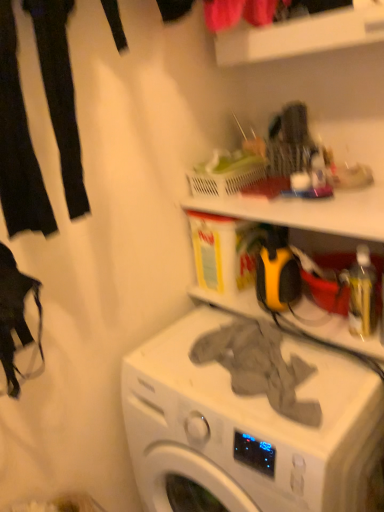
You are a GUI agent. You are given a task and a screenshot of the screen. Output one action in this format:
    pyautogui.click(x=<x>, y=<y>)
    Task: Click on the translucent plastic basket at upper center
    This screenshot has height=512, width=384.
    Given the screenshot: What is the action you would take?
    pyautogui.click(x=224, y=179)

In order to face black fabric pants at left, which is the 1th clothing in left-to-right order, should I rotate leftwards or rightwards?

You should rotate left by 20.965 degrees.

Describe the element at coordinates (259, 366) in the screenshot. I see `gray fabric at center, acting as the 1th clothing starting from the right` at that location.

I want to click on translucent plastic basket at upper center, so click(224, 179).

Could you measure the distance between gray fabric at center, which is counted as the second clothing, starting from the left, and black fabric pants at left, which is counted as the 1th clothing, starting from the top?

gray fabric at center, which is counted as the second clothing, starting from the left, and black fabric pants at left, which is counted as the 1th clothing, starting from the top, are 60.79 centimeters apart.

Considering the relative sizes of gray fabric at center, placed as the first clothing when sorted from bottom to top, and black fabric pants at left, which is counted as the 1th clothing, starting from the top, in the image provided, is gray fabric at center, placed as the first clothing when sorted from bottom to top, taller than black fabric pants at left, which is counted as the 1th clothing, starting from the top,?

Incorrect, the height of gray fabric at center, placed as the first clothing when sorted from bottom to top, is not larger of that of black fabric pants at left, which is counted as the 1th clothing, starting from the top.

Which of these two, gray fabric at center, which is counted as the second clothing, starting from the left, or black fabric pants at left, the second clothing from the right, is bigger?

Bigger between the two is black fabric pants at left, the second clothing from the right.

Does gray fabric at center, which is counted as the second clothing, starting from the left, have a larger size compared to translucent plastic basket at upper center?

Correct, gray fabric at center, which is counted as the second clothing, starting from the left, is larger in size than translucent plastic basket at upper center.

Considering the positions of objects gray fabric at center, acting as the 1th clothing starting from the right, and translucent plastic basket at upper center in the image provided, who is behind, gray fabric at center, acting as the 1th clothing starting from the right, or translucent plastic basket at upper center?

Positioned behind is translucent plastic basket at upper center.

Can you confirm if gray fabric at center, which appears as the second clothing when viewed from the top, is taller than translucent plastic basket at upper center?

Correct, gray fabric at center, which appears as the second clothing when viewed from the top, is much taller as translucent plastic basket at upper center.

In the scene shown: Which point is more forward, (229, 350) or (235, 190)?

The point (229, 350) is closer.

Does point (79, 147) come closer to viewer compared to point (298, 381)?

Yes, point (79, 147) is closer to viewer.

Which object is positioned more to the right, black fabric pants at left, the second clothing ordered from the bottom, or gray fabric at center?

Positioned to the right is gray fabric at center.

Can you tell me how much black fabric pants at left, the second clothing ordered from the bottom, and gray fabric at center differ in facing direction?

The facing directions of black fabric pants at left, the second clothing ordered from the bottom, and gray fabric at center are 89.2 degrees apart.

From the image's perspective, count 2nd clothings upward from the gray fabric at center and point to it. Please provide its 2D coordinates.

[(60, 94)]

Is translucent plastic basket at upper center not close to black fabric pants at left, the second clothing ordered from the bottom?

No.

From the image's perspective, is translucent plastic basket at upper center positioned above or below black fabric pants at left, the second clothing from the right?

Clearly, from the image's perspective, translucent plastic basket at upper center is below black fabric pants at left, the second clothing from the right.

Which is closer, (199, 192) or (64, 145)?

Point (199, 192) appears to be farther away from the viewer than point (64, 145).

Is translucent plastic basket at upper center shorter than gray fabric at center?

Yes, translucent plastic basket at upper center is shorter than gray fabric at center.

Are translucent plastic basket at upper center and gray fabric at center located far from each other?

Actually, translucent plastic basket at upper center and gray fabric at center are a little close together.

Which object is thinner, translucent plastic basket at upper center or gray fabric at center?

With smaller width is translucent plastic basket at upper center.

Which is behind, gray fabric at center or translucent plastic basket at upper center?

translucent plastic basket at upper center is more distant.

Is gray fabric at center to the left of translucent plastic basket at upper center from the viewer's perspective?

No.

Does gray fabric at center have a lesser width compared to translucent plastic basket at upper center?

No.

Is gray fabric at center taller or shorter than translucent plastic basket at upper center?

gray fabric at center is taller than translucent plastic basket at upper center.

What's the angular difference between black fabric pants at left, the second clothing from the right, and gray fabric at center, which appears as the second clothing when viewed from the top,'s facing directions?

The angular difference between black fabric pants at left, the second clothing from the right, and gray fabric at center, which appears as the second clothing when viewed from the top, is 87.4 degrees.

Is black fabric pants at left, the second clothing from the right, in contact with gray fabric at center, which is counted as the second clothing, starting from the left?

They are not placed beside each other.

Measure the distance between black fabric pants at left, which is the 1th clothing in left-to-right order, and gray fabric at center, which appears as the second clothing when viewed from the top.

black fabric pants at left, which is the 1th clothing in left-to-right order, is 23.93 inches from gray fabric at center, which appears as the second clothing when viewed from the top.

Is black fabric pants at left, the second clothing ordered from the bottom, to the left or to the right of gray fabric at center, which is counted as the second clothing, starting from the left, in the image?

black fabric pants at left, the second clothing ordered from the bottom, is to the left of gray fabric at center, which is counted as the second clothing, starting from the left.

At what (x,y) coordinates should I click in order to perform the action: click on clothing located below the black fabric pants at left, which is counted as the 1th clothing, starting from the top (from the image's perspective). Please return your answer as a coordinate pair (x, y). The width and height of the screenshot is (384, 512). Looking at the image, I should click on (259, 366).

You are a GUI agent. You are given a task and a screenshot of the screen. Output one action in this format:
    pyautogui.click(x=<x>, y=<y>)
    Task: Click on the clothing beneath the translucent plastic basket at upper center (from a real-world perspective)
    
    Given the screenshot: What is the action you would take?
    pos(259,366)

When comparing their distances from gray fabric at center, which is counted as the second clothing, starting from the left, does gray fabric at center or translucent plastic basket at upper center seem further?

The object further to gray fabric at center, which is counted as the second clothing, starting from the left, is translucent plastic basket at upper center.

When comparing their distances from gray fabric at center, does black fabric pants at left, the second clothing ordered from the bottom, or translucent plastic basket at upper center seem closer?

translucent plastic basket at upper center.

From the image, which object appears to be nearer to black fabric pants at left, which is counted as the 1th clothing, starting from the top, translucent plastic basket at upper center or gray fabric at center, which appears as the second clothing when viewed from the top?

translucent plastic basket at upper center is positioned closer to the anchor black fabric pants at left, which is counted as the 1th clothing, starting from the top.

Considering their positions, is gray fabric at center, acting as the 1th clothing starting from the right, positioned closer to gray fabric at center than translucent plastic basket at upper center?

Based on the image, gray fabric at center, acting as the 1th clothing starting from the right, appears to be nearer to gray fabric at center.

Considering their positions, is gray fabric at center positioned closer to translucent plastic basket at upper center than black fabric pants at left, the second clothing ordered from the bottom?

black fabric pants at left, the second clothing ordered from the bottom.

From the image, which object appears to be nearer to gray fabric at center, placed as the first clothing when sorted from bottom to top, translucent plastic basket at upper center or gray fabric at center?

gray fabric at center lies closer to gray fabric at center, placed as the first clothing when sorted from bottom to top, than the other object.

From the image, which object appears to be nearer to gray fabric at center, acting as the 1th clothing starting from the right, gray fabric at center or black fabric pants at left, which is the 1th clothing in left-to-right order?

gray fabric at center is closer to gray fabric at center, acting as the 1th clothing starting from the right.

Considering their positions, is black fabric pants at left, which is the 1th clothing in left-to-right order, positioned further to gray fabric at center, acting as the 1th clothing starting from the right, than translucent plastic basket at upper center?

The object further to gray fabric at center, acting as the 1th clothing starting from the right, is black fabric pants at left, which is the 1th clothing in left-to-right order.

Where is `clothing that lies between translucent plastic basket at upper center and gray fabric at center from top to bottom`? This screenshot has width=384, height=512. clothing that lies between translucent plastic basket at upper center and gray fabric at center from top to bottom is located at coordinates (259, 366).

Locate an element on the screen. Image resolution: width=384 pixels, height=512 pixels. basket between black fabric pants at left, which is counted as the 1th clothing, starting from the top, and gray fabric at center, which is counted as the second clothing, starting from the left, from top to bottom is located at coordinates (224, 179).

Locate an element on the screen. The width and height of the screenshot is (384, 512). clothing between black fabric pants at left, the second clothing ordered from the bottom, and gray fabric at center vertically is located at coordinates (259, 366).

Where is `basket between black fabric pants at left, the second clothing ordered from the bottom, and gray fabric at center vertically`? This screenshot has width=384, height=512. basket between black fabric pants at left, the second clothing ordered from the bottom, and gray fabric at center vertically is located at coordinates (224, 179).